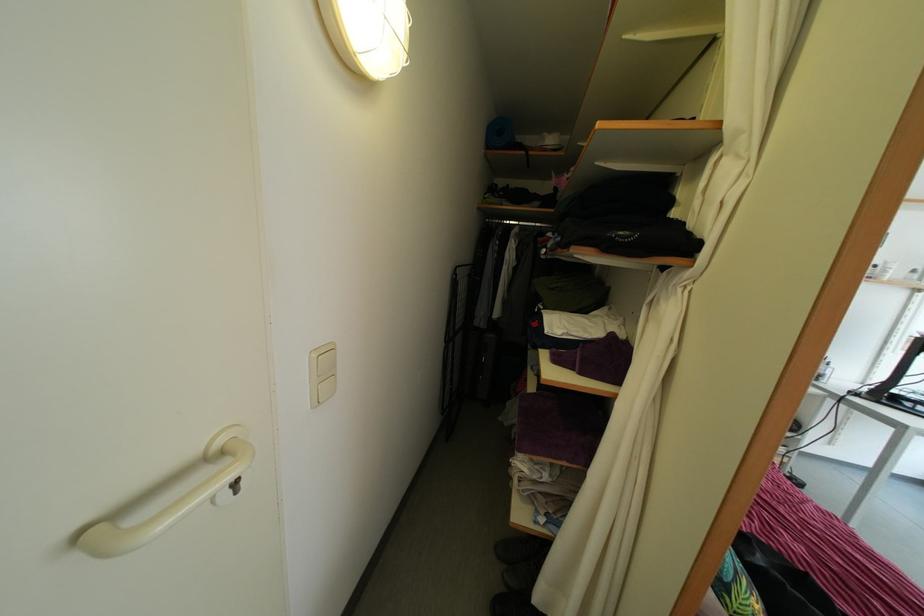
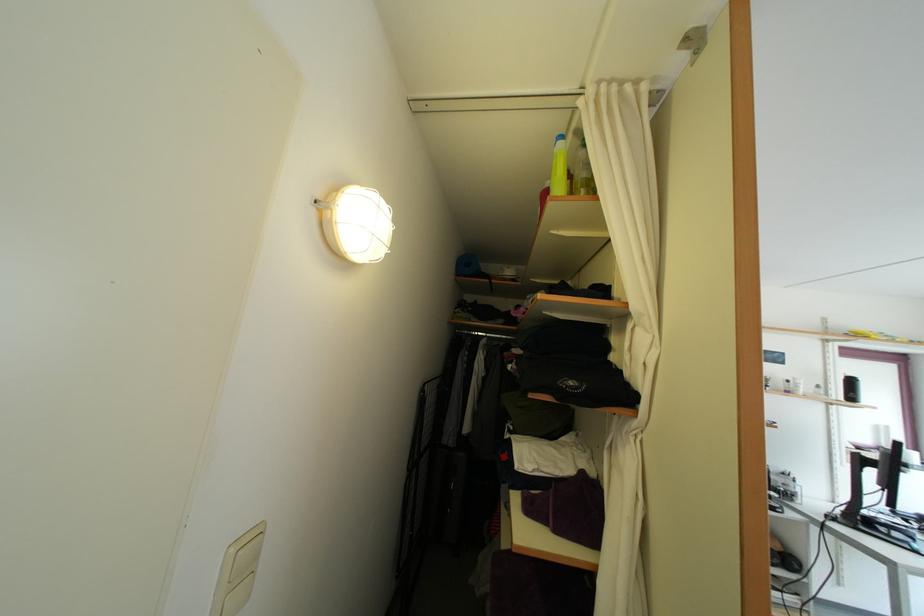
Find the pixel in the second image that matches point (321, 363) in the first image.

(239, 559)